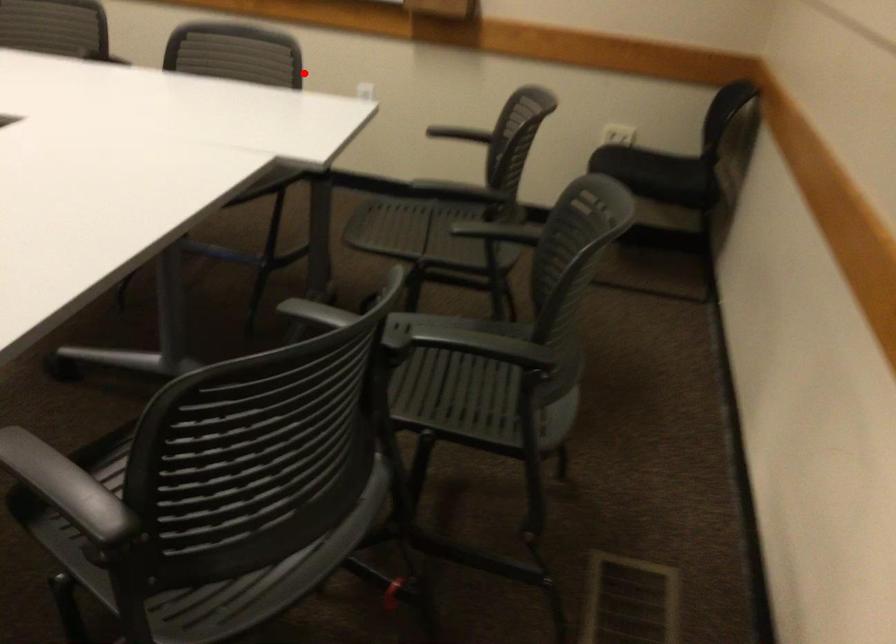
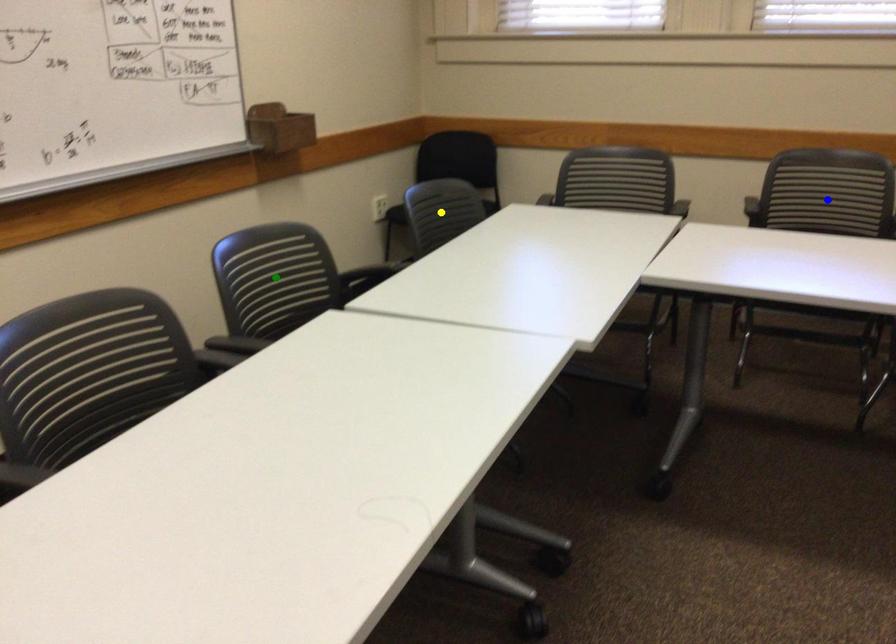
Question: I am providing you with two images of the same scene from different viewpoints. A red point is marked on the first image. You are given multiple points on the second image. In image 2, which mark is for the same physical point as the one in image 1?

Choices:
 (A) green point
 (B) blue point
 (C) yellow point

Answer: (C)